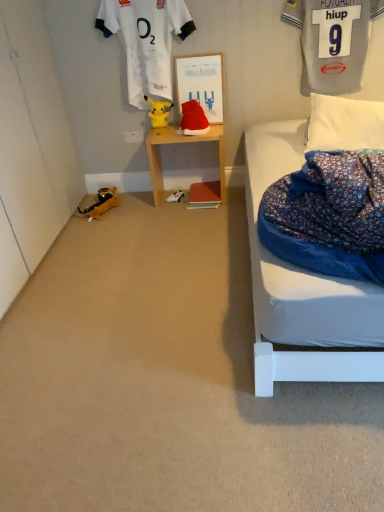
Where is `vacant space in front of yellow rubber duck at lower left, positioned as the 1th toy in bottom-to-top order`? Image resolution: width=384 pixels, height=512 pixels. vacant space in front of yellow rubber duck at lower left, positioned as the 1th toy in bottom-to-top order is located at coordinates (101, 223).